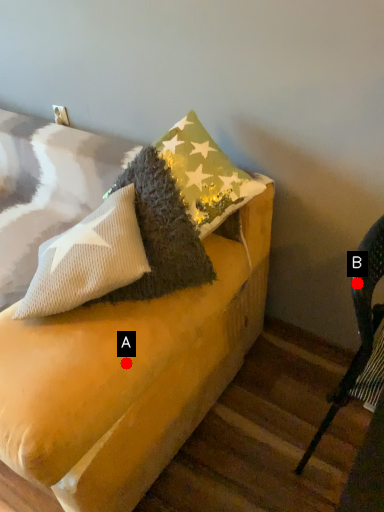
Question: Two points are circled on the image, labeled by A and B beside each circle. Among these points, which one is farthest from the camera?

Choices:
 (A) A is further
 (B) B is further

Answer: (A)